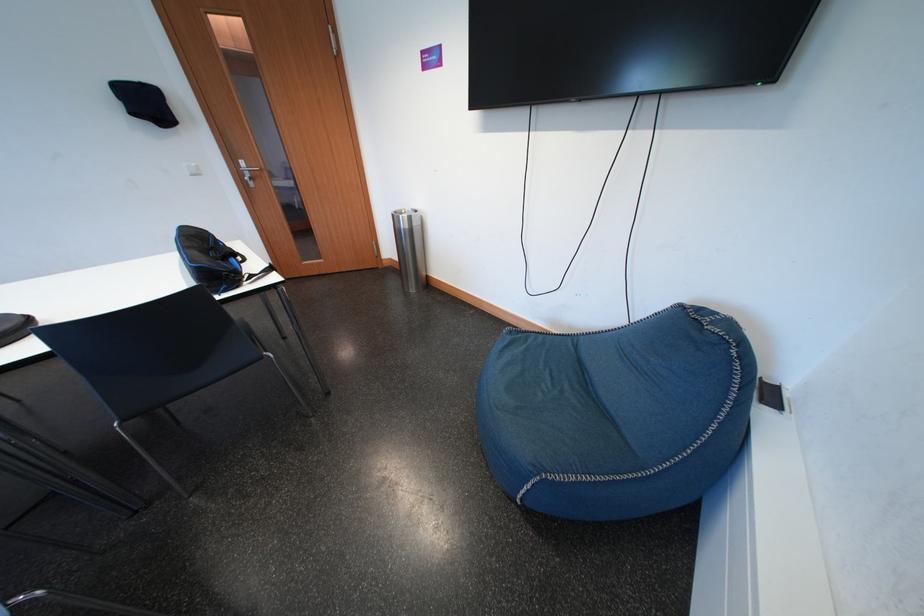
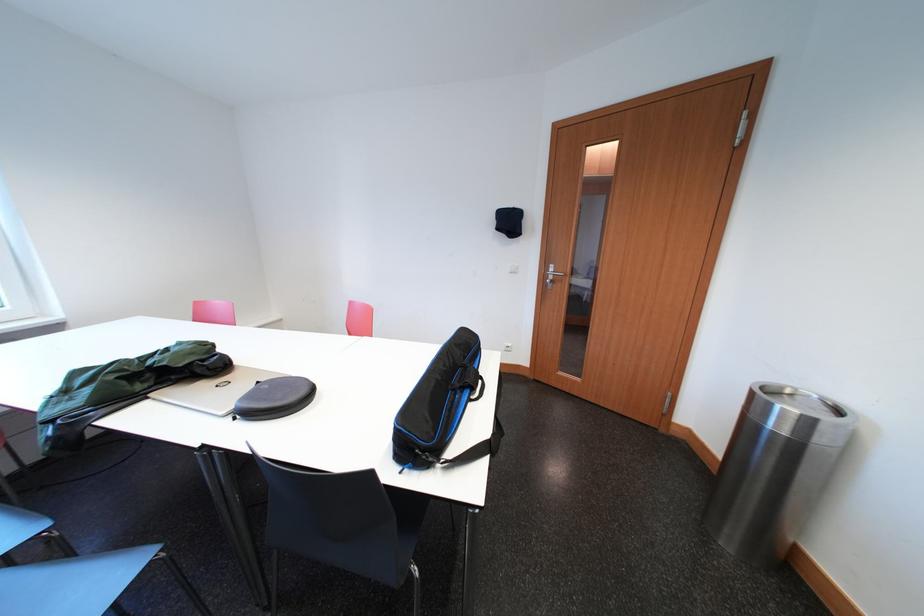
Locate, in the second image, the point that corresponds to [419,223] in the first image.

(819, 426)